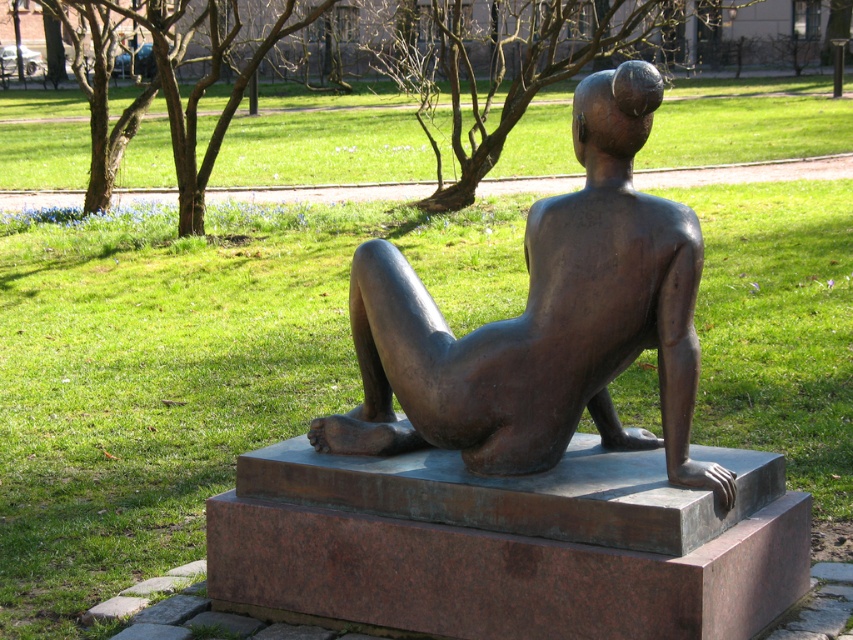
Between point (457, 403) and point (811, 150), which one is positioned behind?

Point (811, 150)

Find the location of a particular element. The height and width of the screenshot is (640, 853). bronze statue at center is located at coordinates (543, 321).

The image size is (853, 640). What are the coordinates of `bronze statue at center` in the screenshot? It's located at (543, 321).